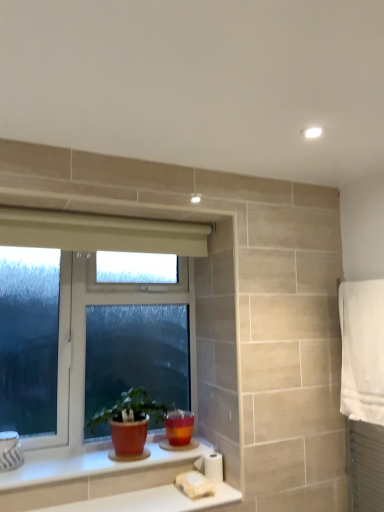
What are the coordinates of `free space above white glossy counter top at lower center, arranged as the second counter top when ordered from the bottom (from a real-world perspective)` in the screenshot? It's located at (91, 461).